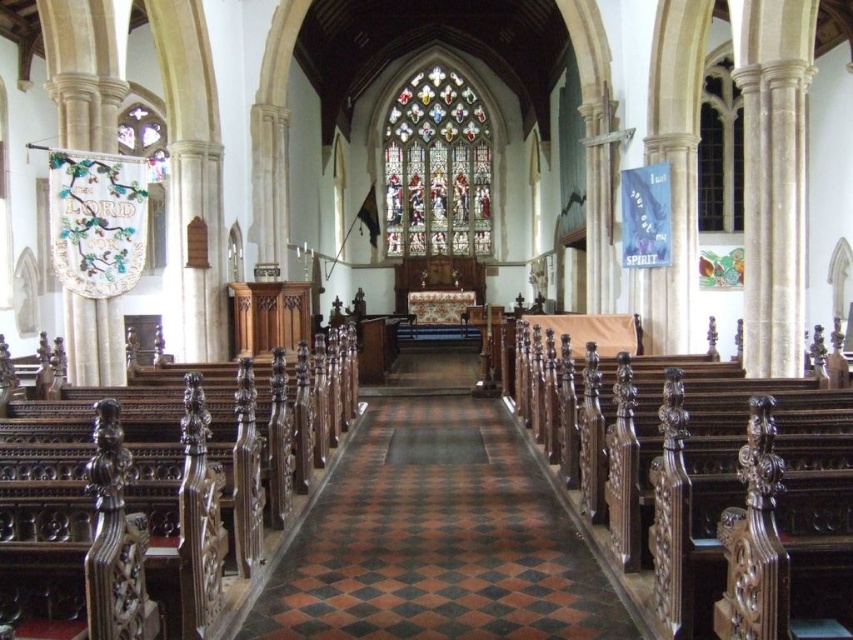
Question: Can you confirm if brown polished wood aisle at center is positioned below stained glass window at center?

Choices:
 (A) no
 (B) yes

Answer: (B)

Question: Where is brown polished wood aisle at center located in relation to stained glass window at center in the image?

Choices:
 (A) below
 (B) above

Answer: (A)

Question: Is brown polished wood aisle at center positioned in front of stained glass window at center?

Choices:
 (A) no
 (B) yes

Answer: (B)

Question: Which point is farther to the camera?

Choices:
 (A) (370, 502)
 (B) (418, 154)

Answer: (B)